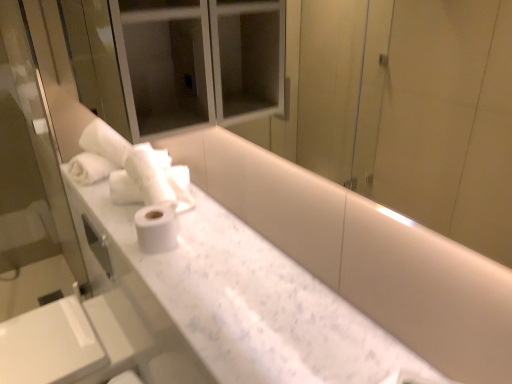
Find the location of a particular element. Image resolution: width=512 pixels, height=384 pixels. white matte toilet paper at center is located at coordinates (156, 228).

Measure the distance between white soft towel at upper left and camera.

white soft towel at upper left and camera are 3.96 feet apart from each other.

Where is `white matte toilet paper at center`? white matte toilet paper at center is located at coordinates (156, 228).

From a real-world perspective, relative to white matte toilet paper at center, is white soft towel at upper left vertically above or below?

white soft towel at upper left is above white matte toilet paper at center.

From the image's perspective, is white soft towel at upper left located above or below white matte toilet paper at center?

Based on their image positions, white soft towel at upper left is located above white matte toilet paper at center.

Would you say white matte toilet paper at center is part of white soft towel at upper left's contents?

Definitely not — white matte toilet paper at center is not inside white soft towel at upper left.

Looking at this image, from a real-world perspective, which is physically below, white marble counter at center or white marble sink at lower left?

white marble sink at lower left is physically lower.

Between white marble counter at center and white marble sink at lower left, which one has smaller width?

white marble counter at center is thinner.

Which object is positioned more to the left, white marble counter at center or white marble sink at lower left?

From the viewer's perspective, white marble sink at lower left appears more on the left side.

Is white matte toilet paper at center facing away from white marble sink at lower left?

No, white matte toilet paper at center is not facing away from white marble sink at lower left.

Does white matte toilet paper at center have a smaller size compared to white marble sink at lower left?

Indeed, white matte toilet paper at center has a smaller size compared to white marble sink at lower left.

From the image's perspective, is white matte toilet paper at center located beneath white marble sink at lower left?

Actually, white matte toilet paper at center appears above white marble sink at lower left in the image.

Is white matte toilet paper at center shorter than white marble sink at lower left?

Correct, white matte toilet paper at center is not as tall as white marble sink at lower left.

Which object is wider, white marble sink at lower left or white matte toilet paper at center?

Wider between the two is white marble sink at lower left.

From a real-world perspective, is white marble sink at lower left on white matte toilet paper at center?

No, from a real-world perspective, white marble sink at lower left is not over white matte toilet paper at center

Can you confirm if white marble sink at lower left is positioned to the right of white matte toilet paper at center?

In fact, white marble sink at lower left is to the left of white matte toilet paper at center.

This screenshot has width=512, height=384. There is a white marble sink at lower left. Identify the location of bath towel above it (from a real-world perspective). (128, 167).

Which is more distant, [169,195] or [101,377]?

The point [101,377] is more distant.

From a real-world perspective, is white soft towel at upper left below white marble sink at lower left?

No, from a real-world perspective, white soft towel at upper left is not beneath white marble sink at lower left.

Between white soft towel at upper left and white marble sink at lower left, which one has smaller width?

Thinner between the two is white soft towel at upper left.

Locate an element on the screen. The image size is (512, 384). bath towel above the white marble sink at lower left (from a real-world perspective) is located at coordinates (128, 167).

Can we say white marble sink at lower left lies outside white soft towel at upper left?

Yes, white marble sink at lower left is not within white soft towel at upper left.

From the picture: From the image's perspective, who appears lower, white marble sink at lower left or white soft towel at upper left?

white marble sink at lower left.

Considering their positions, is white marble sink at lower left located in front of or behind white soft towel at upper left?

In the image, white marble sink at lower left appears in front of white soft towel at upper left.

How distant is white marble counter at center from white matte toilet paper at center?

They are 8.55 inches apart.

In the scene shown: In the image, is white marble counter at center positioned in front of or behind white matte toilet paper at center?

Visually, white marble counter at center is located in front of white matte toilet paper at center.

Is white marble counter at center bigger or smaller than white matte toilet paper at center?

Considering their sizes, white marble counter at center takes up more space than white matte toilet paper at center.

Is white marble counter at center not inside white matte toilet paper at center?

That's correct, white marble counter at center is outside of white matte toilet paper at center.

You are a GUI agent. You are given a task and a screenshot of the screen. Output one action in this format:
    pyautogui.click(x=<x>, y=<y>)
    Task: Click on the toilet paper on the right of white soft towel at upper left
    Image resolution: width=512 pixels, height=384 pixels.
    Given the screenshot: What is the action you would take?
    pyautogui.click(x=156, y=228)

Image resolution: width=512 pixels, height=384 pixels. Find the location of `counter in front of the white marble sink at lower left`. counter in front of the white marble sink at lower left is located at coordinates (249, 300).

When comparing their distances from white soft towel at upper left, does white marble counter at center or white marble sink at lower left seem further?

white marble sink at lower left.

When comparing their distances from white marble sink at lower left, does white marble counter at center or white soft towel at upper left seem further?

white marble counter at center is further to white marble sink at lower left.

Based on their spatial positions, is white soft towel at upper left or white marble counter at center further from white marble sink at lower left?

Among the two, white marble counter at center is located further to white marble sink at lower left.

Estimate the real-world distances between objects in this image. Which object is closer to white marble counter at center, white matte toilet paper at center or white marble sink at lower left?

white matte toilet paper at center is closer to white marble counter at center.

Considering their positions, is white matte toilet paper at center positioned closer to white soft towel at upper left than white marble counter at center?

white marble counter at center lies closer to white soft towel at upper left than the other object.

Based on their spatial positions, is white marble sink at lower left or white soft towel at upper left closer to white marble counter at center?

Among the two, white soft towel at upper left is located nearer to white marble counter at center.

Looking at the image, which one is located further to white marble sink at lower left, white soft towel at upper left or white matte toilet paper at center?

white matte toilet paper at center is positioned further to the anchor white marble sink at lower left.

Considering their positions, is white soft towel at upper left positioned closer to white matte toilet paper at center than white marble counter at center?

Among the two, white marble counter at center is located nearer to white matte toilet paper at center.

Where is `toilet paper between white soft towel at upper left and white marble sink at lower left from top to bottom`? This screenshot has width=512, height=384. toilet paper between white soft towel at upper left and white marble sink at lower left from top to bottom is located at coordinates (156, 228).

Find the location of a particular element. This screenshot has height=384, width=512. counter that lies between white soft towel at upper left and white marble sink at lower left from top to bottom is located at coordinates (249, 300).

Find the location of a particular element. The height and width of the screenshot is (384, 512). toilet paper between white marble counter at center and white soft towel at upper left in the front-back direction is located at coordinates (156, 228).

Identify the location of counter that lies between white matte toilet paper at center and white marble sink at lower left from top to bottom. This screenshot has width=512, height=384. (249, 300).